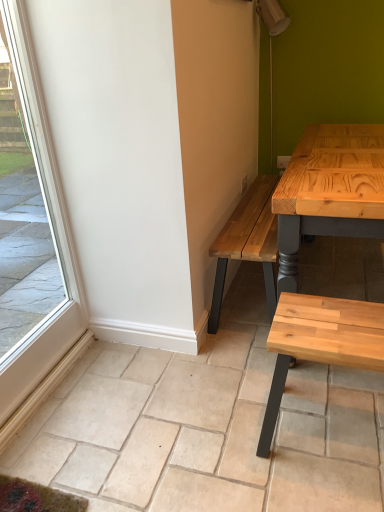
Question: Is natural wood bench at lower right positioned before natural stone tile at lower center?

Choices:
 (A) no
 (B) yes

Answer: (A)

Question: Is natural wood bench at lower right shorter than natural stone tile at lower center?

Choices:
 (A) yes
 (B) no

Answer: (B)

Question: Is natural wood bench at lower right wider than natural stone tile at lower center?

Choices:
 (A) no
 (B) yes

Answer: (A)

Question: Is natural wood bench at lower right with natural stone tile at lower center?

Choices:
 (A) yes
 (B) no

Answer: (B)

Question: Are natural wood bench at lower right and natural stone tile at lower center far apart?

Choices:
 (A) yes
 (B) no

Answer: (B)

Question: Considering the positions of clear glass window at left and natural wood bench at lower right in the image, is clear glass window at left wider or thinner than natural wood bench at lower right?

Choices:
 (A) wide
 (B) thin

Answer: (B)

Question: In terms of size, does clear glass window at left appear bigger or smaller than natural wood bench at lower right?

Choices:
 (A) big
 (B) small

Answer: (B)

Question: From a real-world perspective, relative to natural wood bench at lower right, is clear glass window at left vertically above or below?

Choices:
 (A) above
 (B) below

Answer: (A)

Question: Considering their positions, is clear glass window at left located in front of or behind natural wood bench at lower right?

Choices:
 (A) front
 (B) behind

Answer: (A)

Question: In the image, is natural stone tile at lower center positioned in front of or behind natural wood bench at lower right?

Choices:
 (A) front
 (B) behind

Answer: (A)

Question: Looking at their shapes, would you say natural stone tile at lower center is wider or thinner than natural wood bench at lower right?

Choices:
 (A) wide
 (B) thin

Answer: (A)

Question: Would you say natural stone tile at lower center is inside or outside natural wood bench at lower right?

Choices:
 (A) outside
 (B) inside

Answer: (A)

Question: Is point [56, 404] closer or farther from the camera than point [306, 342]?

Choices:
 (A) farther
 (B) closer

Answer: (A)

Question: Is natural wood bench at lower right wider or thinner than clear glass window at left?

Choices:
 (A) wide
 (B) thin

Answer: (A)

Question: In terms of size, does natural wood bench at lower right appear bigger or smaller than clear glass window at left?

Choices:
 (A) small
 (B) big

Answer: (B)